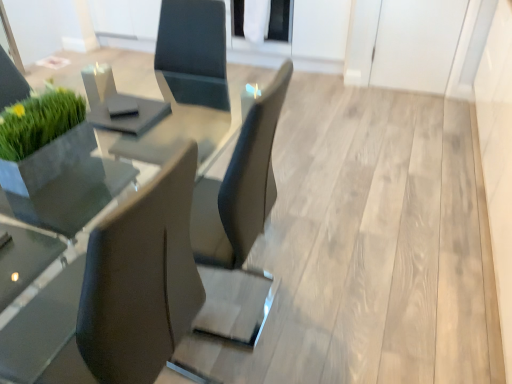
Question: Is clear glass table at center turned away from transparent glass door at upper center?

Choices:
 (A) no
 (B) yes

Answer: (A)

Question: Is clear glass table at center facing towards transparent glass door at upper center?

Choices:
 (A) yes
 (B) no

Answer: (B)

Question: Is clear glass table at center bigger than transparent glass door at upper center?

Choices:
 (A) no
 (B) yes

Answer: (B)

Question: Does clear glass table at center have a greater width compared to transparent glass door at upper center?

Choices:
 (A) no
 (B) yes

Answer: (B)

Question: From a real-world perspective, is clear glass table at center physically below transparent glass door at upper center?

Choices:
 (A) yes
 (B) no

Answer: (A)

Question: From their relative heights in the image, would you say clear glass table at center is taller or shorter than matte black chair at left?

Choices:
 (A) short
 (B) tall

Answer: (A)

Question: From a real-world perspective, is clear glass table at center above or below matte black chair at left?

Choices:
 (A) above
 (B) below

Answer: (B)

Question: Is point (80, 180) positioned closer to the camera than point (152, 273)?

Choices:
 (A) closer
 (B) farther

Answer: (B)

Question: In the image, is clear glass table at center positioned in front of or behind matte black chair at left?

Choices:
 (A) behind
 (B) front

Answer: (A)

Question: Looking at their shapes, would you say matte black chair at left is wider or thinner than clear glass table at center?

Choices:
 (A) thin
 (B) wide

Answer: (A)

Question: Relative to clear glass table at center, is matte black chair at left in front or behind?

Choices:
 (A) behind
 (B) front

Answer: (B)

Question: Is point (162, 249) positioned closer to the camera than point (71, 177)?

Choices:
 (A) farther
 (B) closer

Answer: (B)

Question: From a real-world perspective, is matte black chair at left above or below clear glass table at center?

Choices:
 (A) above
 (B) below

Answer: (A)

Question: From the image's perspective, is transparent glass door at upper center located above or below clear glass table at center?

Choices:
 (A) above
 (B) below

Answer: (A)

Question: From their relative heights in the image, would you say transparent glass door at upper center is taller or shorter than clear glass table at center?

Choices:
 (A) short
 (B) tall

Answer: (A)